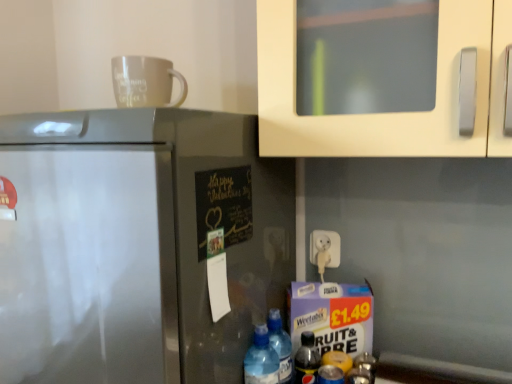
Question: Are satin silver refrigerator at left and translucent plastic bottle at lower right, marked as the 4th bottle in a left-to-right arrangement, far apart?

Choices:
 (A) yes
 (B) no

Answer: (B)

Question: Is satin silver refrigerator at left aimed at translucent plastic bottle at lower right, marked as the 4th bottle in a left-to-right arrangement?

Choices:
 (A) yes
 (B) no

Answer: (B)

Question: Considering the relative positions of satin silver refrigerator at left and translucent plastic bottle at lower right, marked as the 4th bottle in a left-to-right arrangement, in the image provided, is satin silver refrigerator at left in front of translucent plastic bottle at lower right, marked as the 4th bottle in a left-to-right arrangement,?

Choices:
 (A) yes
 (B) no

Answer: (A)

Question: Is translucent plastic bottle at lower right, the 1th bottle from the right, at the back of satin silver refrigerator at left?

Choices:
 (A) no
 (B) yes

Answer: (A)

Question: From the image's perspective, does satin silver refrigerator at left appear higher than translucent plastic bottle at lower right, the 1th bottle from the right?

Choices:
 (A) no
 (B) yes

Answer: (B)

Question: From the image's perspective, would you say satin silver refrigerator at left is shown under translucent plastic bottle at lower right, marked as the 4th bottle in a left-to-right arrangement?

Choices:
 (A) yes
 (B) no

Answer: (B)

Question: Does translucent plastic bottles at lower center, which ranks as the first bottle in left-to-right order, have a larger size compared to translucent plastic bottle at lower right, the 1th bottle from the right?

Choices:
 (A) yes
 (B) no

Answer: (A)

Question: Does translucent plastic bottles at lower center, the 4th bottle from the right, have a lesser width compared to translucent plastic bottle at lower right, the 1th bottle from the right?

Choices:
 (A) no
 (B) yes

Answer: (A)

Question: From a real-world perspective, is translucent plastic bottles at lower center, the 4th bottle from the right, beneath translucent plastic bottle at lower right, the 1th bottle from the right?

Choices:
 (A) no
 (B) yes

Answer: (A)

Question: From the image's perspective, is translucent plastic bottles at lower center, the 4th bottle from the right, located above translucent plastic bottle at lower right, the 1th bottle from the right?

Choices:
 (A) no
 (B) yes

Answer: (B)

Question: Considering the relative positions of translucent plastic bottles at lower center, which ranks as the first bottle in left-to-right order, and translucent plastic bottle at lower right, marked as the 4th bottle in a left-to-right arrangement, in the image provided, is translucent plastic bottles at lower center, which ranks as the first bottle in left-to-right order, to the left of translucent plastic bottle at lower right, marked as the 4th bottle in a left-to-right arrangement, from the viewer's perspective?

Choices:
 (A) no
 (B) yes

Answer: (B)

Question: From a real-world perspective, is translucent plastic bottles at lower center, which ranks as the first bottle in left-to-right order, on translucent plastic bottle at lower right, marked as the 4th bottle in a left-to-right arrangement?

Choices:
 (A) yes
 (B) no

Answer: (A)

Question: Is matte white mug at upper center next to chalkboard paper at center and touching it?

Choices:
 (A) yes
 (B) no

Answer: (B)